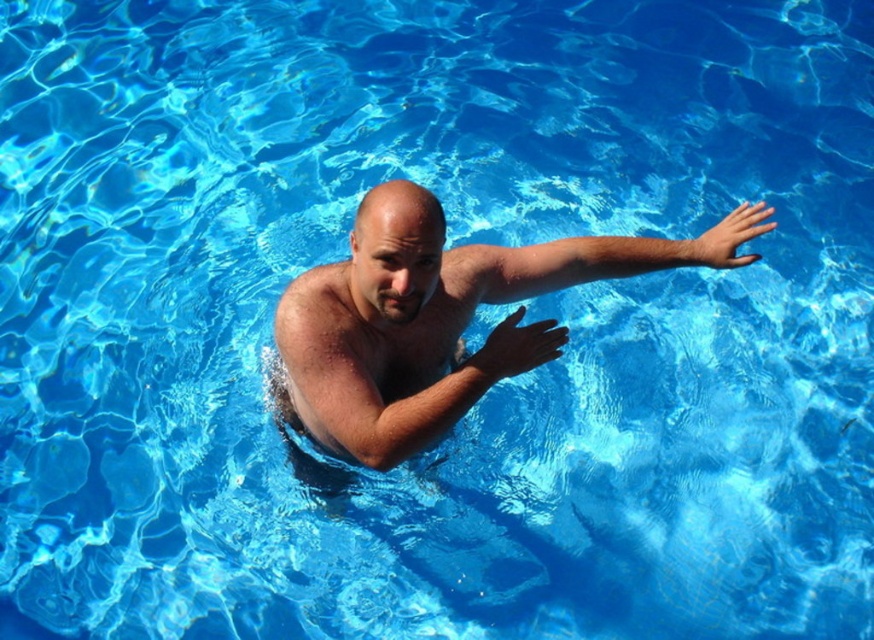
Question: Does slick skin arm at upper right appear on the left side of matte blue hand at upper right?

Choices:
 (A) yes
 (B) no

Answer: (A)

Question: Can you confirm if smooth skin hand at center is bigger than matte blue hand at upper right?

Choices:
 (A) yes
 (B) no

Answer: (B)

Question: Which of these objects is positioned farthest from the slick skin arm at upper right?

Choices:
 (A) smooth skin man at center
 (B) smooth skin hand at center
 (C) matte blue hand at upper right

Answer: (B)

Question: Which of the following is the farthest from the observer?

Choices:
 (A) (299, 406)
 (B) (488, 376)

Answer: (A)

Question: Considering the real-world distances, which object is closest to the slick skin arm at center?

Choices:
 (A) slick skin arm at upper right
 (B) matte blue hand at upper right

Answer: (A)

Question: In this image, where is slick skin arm at upper right located relative to matte blue hand at upper right?

Choices:
 (A) above
 (B) below

Answer: (B)